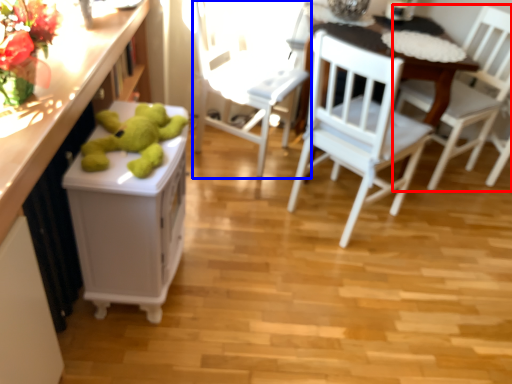
Question: Which of the following is the closest to the observer, chair (highlighted by a red box) or chair (highlighted by a blue box)?

Choices:
 (A) chair
 (B) chair

Answer: (B)